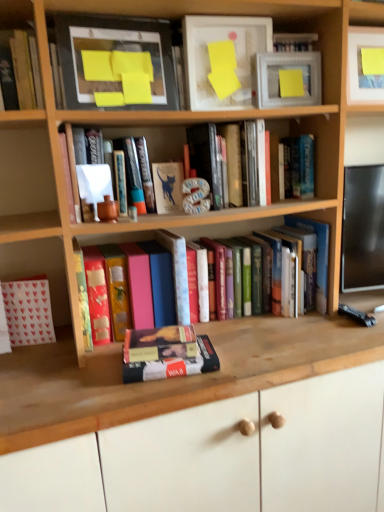
Question: Is there a large distance between matte yellow paper at upper center, the first paperback book positioned from the right, and matte black picture frame at upper left, the 2th picture frame from the right?

Choices:
 (A) yes
 (B) no

Answer: (B)

Question: From a real-world perspective, is matte yellow paper at upper center, the 3th paperback book positioned from the left, under matte black picture frame at upper left, which ranks as the first picture frame in left-to-right order?

Choices:
 (A) no
 (B) yes

Answer: (B)

Question: From a real-world perspective, is matte yellow paper at upper center, the 3th paperback book positioned from the left, positioned over matte black picture frame at upper left, which ranks as the first picture frame in left-to-right order, based on gravity?

Choices:
 (A) no
 (B) yes

Answer: (A)

Question: Is matte yellow paper at upper center, the first paperback book positioned from the right, behind matte black picture frame at upper left, the 2th picture frame from the right?

Choices:
 (A) yes
 (B) no

Answer: (A)

Question: From the image's perspective, would you say matte yellow paper at upper center, positioned as the 1th paperback book in top-to-bottom order, is positioned over matte black picture frame at upper left, which ranks as the first picture frame in left-to-right order?

Choices:
 (A) no
 (B) yes

Answer: (B)

Question: From a real-world perspective, is matte white picture frame at upper right, which appears as the 1th picture frame when viewed from the right, physically located above or below matte black picture frame at upper left, which ranks as the first picture frame in left-to-right order?

Choices:
 (A) below
 (B) above

Answer: (A)

Question: Is matte white picture frame at upper right, positioned as the 2th picture frame in left-to-right order, inside the boundaries of matte black picture frame at upper left, which ranks as the first picture frame in left-to-right order, or outside?

Choices:
 (A) inside
 (B) outside

Answer: (B)

Question: Considering the positions of point (296, 82) and point (87, 37), is point (296, 82) closer or farther from the camera than point (87, 37)?

Choices:
 (A) farther
 (B) closer

Answer: (A)

Question: Based on their sizes in the image, would you say matte white picture frame at upper right, positioned as the 2th picture frame in left-to-right order, is bigger or smaller than matte black picture frame at upper left, the 2th picture frame from the right?

Choices:
 (A) big
 (B) small

Answer: (B)

Question: From a real-world perspective, is white paper bag at lower left, the fifth book positioned from the right, positioned above or below hardcover book at upper left, arranged as the second book when viewed from the left?

Choices:
 (A) below
 (B) above

Answer: (A)

Question: Looking at the image, does white paper bag at lower left, the fifth book positioned from the right, seem bigger or smaller compared to hardcover book at upper left, which is the 4th book in right-to-left order?

Choices:
 (A) big
 (B) small

Answer: (A)

Question: Considering their positions, is white paper bag at lower left, the fifth book positioned from the right, located in front of or behind hardcover book at upper left, which is the 4th book in right-to-left order?

Choices:
 (A) front
 (B) behind

Answer: (B)

Question: Is point (26, 328) closer or farther from the camera than point (24, 72)?

Choices:
 (A) farther
 (B) closer

Answer: (A)

Question: From the image's perspective, relative to matte white book at upper center, which appears as the third book when viewed from the left, is matte white picture frame at upper right, which appears as the 1th picture frame when viewed from the right, above or below?

Choices:
 (A) above
 (B) below

Answer: (A)

Question: Is point (253, 55) positioned closer to the camera than point (91, 163)?

Choices:
 (A) closer
 (B) farther

Answer: (B)